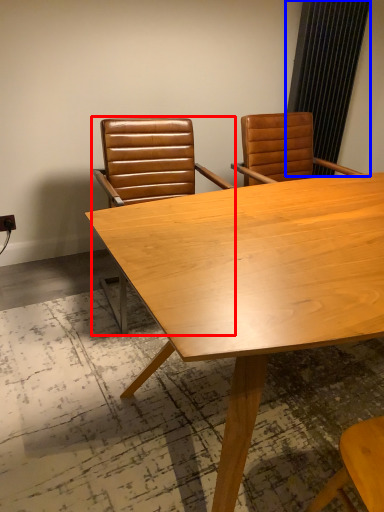
Question: Which object appears farthest to the camera in this image, chair (highlighted by a red box) or curtain (highlighted by a blue box)?

Choices:
 (A) chair
 (B) curtain

Answer: (B)